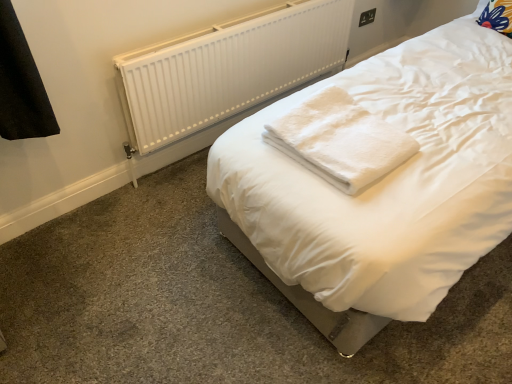
Identify the location of white plastic radiator at upper center. Image resolution: width=512 pixels, height=384 pixels. (228, 68).

Where is `black plastic electric outlet at upper right`? Image resolution: width=512 pixels, height=384 pixels. black plastic electric outlet at upper right is located at coordinates (367, 17).

Is point (369, 18) farther from camera compared to point (381, 172)?

Yes.

Locate an element on the screen. The width and height of the screenshot is (512, 384). electric outlet on the right side of white fluffy towel at center is located at coordinates (367, 17).

Does black plastic electric outlet at upper right turn towards white fluffy towel at center?

No, black plastic electric outlet at upper right is not aimed at white fluffy towel at center.

How far apart are black plastic electric outlet at upper right and white fluffy towel at center?

black plastic electric outlet at upper right and white fluffy towel at center are 1.65 meters apart.

Which is behind, point (298, 143) or point (234, 49)?

Point (234, 49)

Looking at their sizes, would you say white fluffy towel at center is wider or thinner than white plastic radiator at upper center?

Clearly, white fluffy towel at center has more width compared to white plastic radiator at upper center.

Is white fluffy towel at center in front of or behind white plastic radiator at upper center in the image?

Visually, white fluffy towel at center is located in front of white plastic radiator at upper center.

The width and height of the screenshot is (512, 384). Find the location of `cloth above the white plastic radiator at upper center (from a real-world perspective)`. cloth above the white plastic radiator at upper center (from a real-world perspective) is located at coordinates (340, 141).

Is white plastic radiator at upper center placed right next to black plastic electric outlet at upper right?

No, white plastic radiator at upper center is not making contact with black plastic electric outlet at upper right.

Does white plastic radiator at upper center have a smaller size compared to black plastic electric outlet at upper right?

No, white plastic radiator at upper center is not smaller than black plastic electric outlet at upper right.

In the image, is white plastic radiator at upper center on the left side or the right side of black plastic electric outlet at upper right?

white plastic radiator at upper center is positioned on black plastic electric outlet at upper right's left side.

Could you tell me if black plastic electric outlet at upper right is turned towards white plastic radiator at upper center?

No, black plastic electric outlet at upper right does not turn towards white plastic radiator at upper center.

Consider the image. Considering the relative sizes of black plastic electric outlet at upper right and white plastic radiator at upper center in the image provided, is black plastic electric outlet at upper right taller than white plastic radiator at upper center?

Incorrect, the height of black plastic electric outlet at upper right is not larger of that of white plastic radiator at upper center.

This screenshot has height=384, width=512. Identify the location of radiator lying in front of the black plastic electric outlet at upper right. (228, 68).

Which is behind, black plastic electric outlet at upper right or white plastic radiator at upper center?

black plastic electric outlet at upper right is further away from the camera.

Looking at this image, choose the correct answer: Is white fluffy towel at center inside black plastic electric outlet at upper right or outside it?

white fluffy towel at center cannot be found inside black plastic electric outlet at upper right.

Can you tell me how much white fluffy towel at center and black plastic electric outlet at upper right differ in facing direction?

There is a 90.4-degree angle between the facing directions of white fluffy towel at center and black plastic electric outlet at upper right.

Could you tell me if white fluffy towel at center is facing black plastic electric outlet at upper right?

No.

Looking at this image, from the image's perspective, is white fluffy towel at center on black plastic electric outlet at upper right?

Incorrect, from the image's perspective, white fluffy towel at center is lower than black plastic electric outlet at upper right.

Can you tell me how much white plastic radiator at upper center and white fluffy towel at center differ in facing direction?

white plastic radiator at upper center and white fluffy towel at center are facing 90.7 degrees away from each other.

Is white plastic radiator at upper center directly adjacent to white fluffy towel at center?

white plastic radiator at upper center is not next to white fluffy towel at center, and they're not touching.

Is white plastic radiator at upper center at the left side of white fluffy towel at center?

Yes, white plastic radiator at upper center is to the left of white fluffy towel at center.

Between white plastic radiator at upper center and white fluffy towel at center, which one is positioned behind?

Positioned behind is white plastic radiator at upper center.

The width and height of the screenshot is (512, 384). I want to click on electric outlet above the white fluffy towel at center (from the image's perspective), so click(367, 17).

Identify the location of radiator lying on the left of white fluffy towel at center. (228, 68).

Based on their spatial positions, is white plastic radiator at upper center or black plastic electric outlet at upper right further from white fluffy towel at center?

The object further to white fluffy towel at center is black plastic electric outlet at upper right.

Which object lies further to the anchor point white plastic radiator at upper center, black plastic electric outlet at upper right or white fluffy towel at center?

black plastic electric outlet at upper right is positioned further to the anchor white plastic radiator at upper center.

Looking at the image, which one is located further to white fluffy towel at center, black plastic electric outlet at upper right or white plastic radiator at upper center?

black plastic electric outlet at upper right is further to white fluffy towel at center.

Consider the image. From the image, which object appears to be nearer to black plastic electric outlet at upper right, white plastic radiator at upper center or white fluffy towel at center?

white plastic radiator at upper center lies closer to black plastic electric outlet at upper right than the other object.

From the image, which object appears to be farther from white plastic radiator at upper center, white fluffy towel at center or black plastic electric outlet at upper right?

black plastic electric outlet at upper right lies further to white plastic radiator at upper center than the other object.

When comparing their distances from black plastic electric outlet at upper right, does white fluffy towel at center or white plastic radiator at upper center seem closer?

white plastic radiator at upper center lies closer to black plastic electric outlet at upper right than the other object.

In order to click on radiator located between white fluffy towel at center and black plastic electric outlet at upper right in the depth direction in this screenshot , I will do `click(228, 68)`.